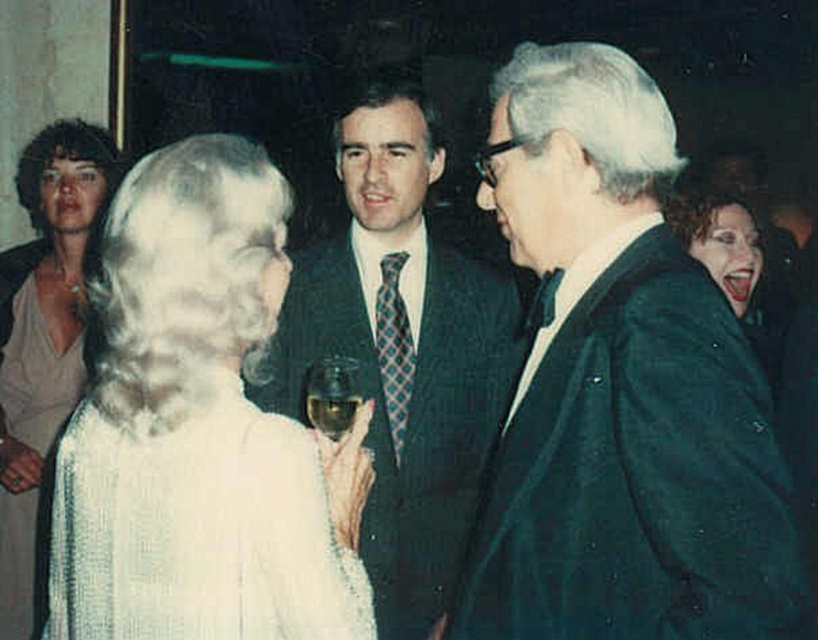
You are a photographer at this event and want to capture a photo that includes both the shiny silver dress at center and the white curly wig at upper right. Given their sizes, which object should you adjust your camera focus to ensure both are in frame without cropping?

Since the shiny silver dress at center is wider than the white curly wig at upper right, you should focus on the shiny silver dress at center to accommodate its larger size, ensuring both objects remain in frame without cropping.

You are a photographer at the event and want to capture a closeup of the white curly wig at upper right without including the other guests. Given that the camera can focus on objects within 1.5 meters, will the wig be in focus?

The white curly wig at upper right is 1.53 meters from the camera, which is slightly beyond the camera focus range of 1.5 meters. Therefore, the wig will not be in focus.